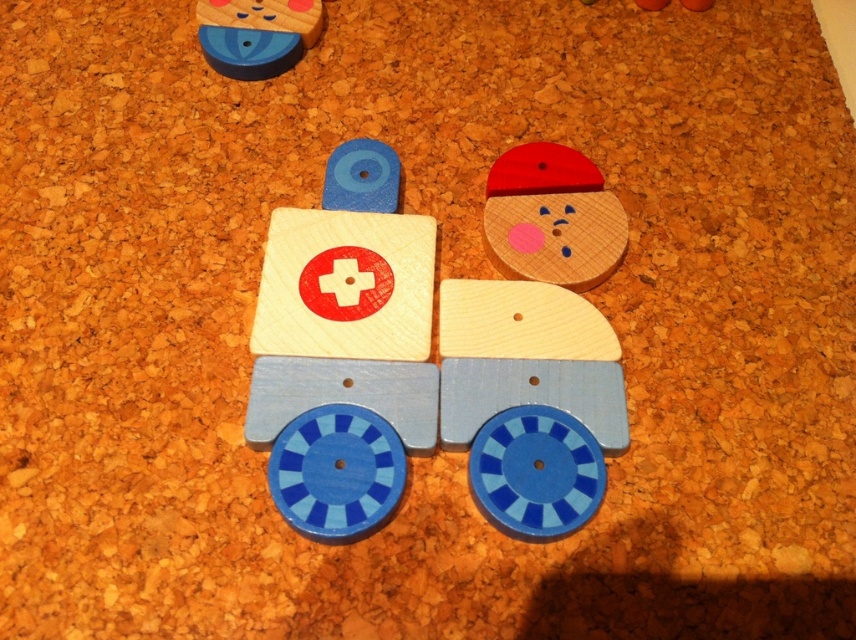
You are organizing a child safety event and need to arrange two wooden pieces on a corkboard. You have the wooden face at upper right and the matte wood block at upper left. If you want to place a third piece between them, where should it go?

The wooden face at upper right is to the right of matte wood block at upper left, so the third piece should be placed between them, to the right of the matte wood block at upper left and to the left of the wooden face at upper right.

You are standing in front of a wooden toy ambulance on a corkboard. You notice two points marked on the ambulance. The first point is at coordinates point (x=369, y=301), and the second is at point (x=528, y=257). From your perspective, which point appears closer to you?

Point (x=369, y=301) is in front of point (x=528, y=257), so it appears closer to you.